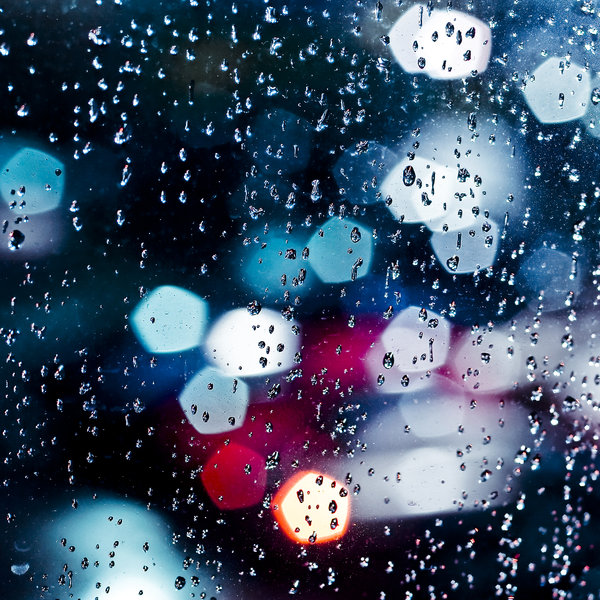
You are a GUI agent. You are given a task and a screenshot of the screen. Output one action in this format:
    pyautogui.click(x=<x>, y=<y>)
    Task: Click on the window
    The image size is (600, 600).
    Given the screenshot: What is the action you would take?
    pyautogui.click(x=175, y=256)